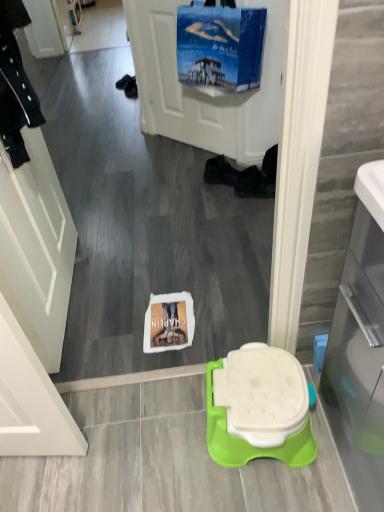
In order to click on vacant space that is to the left of white plastic toilet at center in this screenshot , I will do `click(162, 420)`.